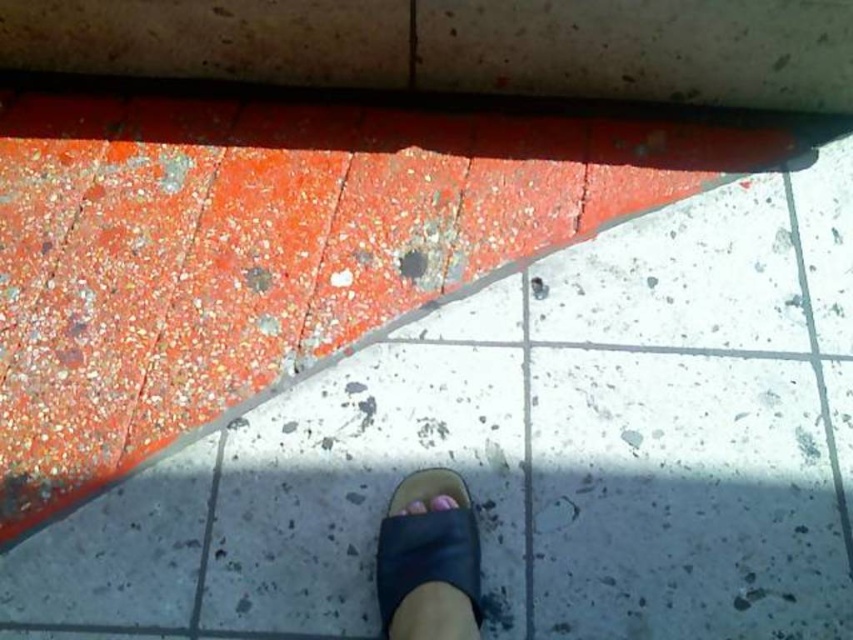
Between point (451, 628) and point (436, 499), which one is positioned in front?

Point (451, 628)

Is black leather sandal at lower center below purple matte toe at center?

Yes.

Which is behind, point (428, 540) or point (437, 499)?

The point (437, 499) is behind.

The width and height of the screenshot is (853, 640). Identify the location of black leather sandal at lower center. (427, 560).

Does purple matte toe at center have a lesser width compared to pink matte toe at center?

Indeed, purple matte toe at center has a lesser width compared to pink matte toe at center.

Between point (433, 508) and point (426, 508), which one is positioned behind?

Positioned behind is point (426, 508).

Locate an element on the screen. purple matte toe at center is located at coordinates (442, 502).

Between point (378, 545) and point (416, 500), which one is positioned behind?

The point (378, 545) is more distant.

Which is below, black leather sandal at lower center or pink matte toe at center?

black leather sandal at lower center is lower down.

Is point (384, 532) positioned before point (405, 506)?

Yes, it is.

The width and height of the screenshot is (853, 640). I want to click on black leather sandal at lower center, so click(x=427, y=560).